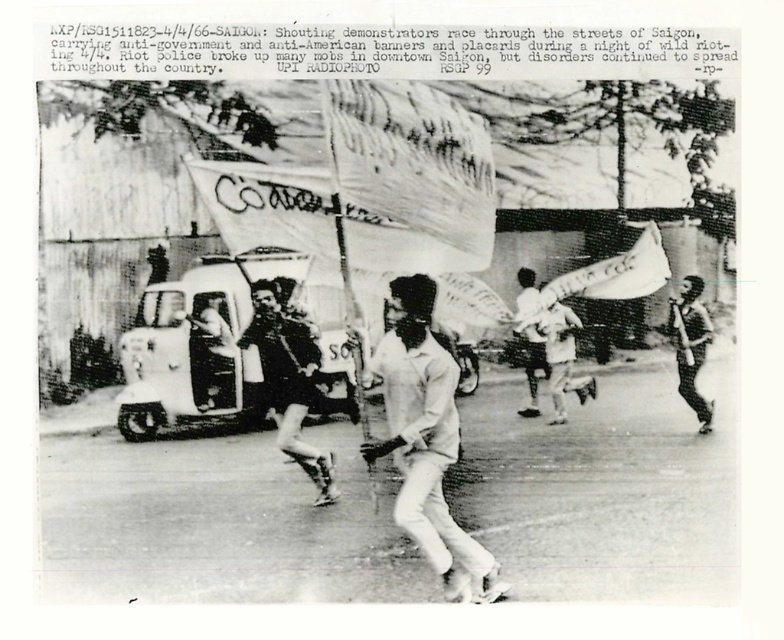
Question: Can you confirm if white matte shirt at center is wider than dark skin human at right?

Choices:
 (A) no
 (B) yes

Answer: (B)

Question: Which point is closer to the camera?

Choices:
 (A) dark skin human at right
 (B) dark brown leather boots at center
 (C) white matte shirt at center

Answer: (C)

Question: Is white matte shirt at center closer to the viewer compared to dark brown leather boots at center?

Choices:
 (A) yes
 (B) no

Answer: (A)

Question: Considering the real-world distances, which object is farthest from the dark skin human at right?

Choices:
 (A) dark brown leather boots at center
 (B) white matte shirt at center

Answer: (A)

Question: Among these points, which one is farthest from the camera?

Choices:
 (A) (278, 435)
 (B) (426, 524)

Answer: (A)

Question: Does white matte shirt at center have a lesser width compared to dark skin human at right?

Choices:
 (A) yes
 (B) no

Answer: (B)